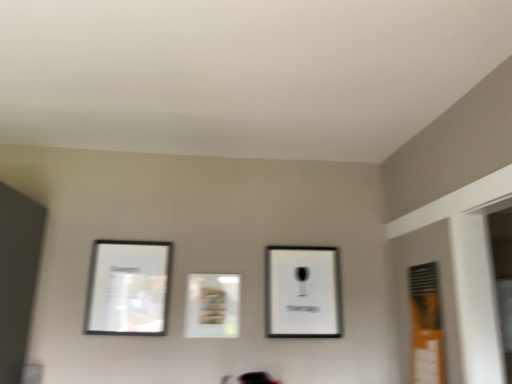
The image size is (512, 384). Describe the element at coordinates (303, 292) in the screenshot. I see `black matte picture frame at upper center, positioned as the first picture frame in right-to-left order` at that location.

The width and height of the screenshot is (512, 384). Describe the element at coordinates (212, 306) in the screenshot. I see `matte white picture frame at center, which ranks as the second picture frame in right-to-left order` at that location.

What do you see at coordinates (128, 288) in the screenshot? This screenshot has height=384, width=512. I see `matte black picture frame at left, which is the third picture frame from right to left` at bounding box center [128, 288].

You are a GUI agent. You are given a task and a screenshot of the screen. Output one action in this format:
    pyautogui.click(x=<x>, y=<y>)
    Task: Click on the black matte picture frame at upper center, which is the third picture frame from left to right
    The height and width of the screenshot is (384, 512).
    Given the screenshot: What is the action you would take?
    pyautogui.click(x=303, y=292)

Is orange matte window at right not close to matte white picture frame at center, which ranks as the second picture frame in right-to-left order?

orange matte window at right is near matte white picture frame at center, which ranks as the second picture frame in right-to-left order, not far away.

The image size is (512, 384). I want to click on window in front of the matte white picture frame at center, which ranks as the second picture frame in right-to-left order, so click(x=426, y=326).

Is orange matte window at right oriented away from matte white picture frame at center, which is counted as the 2th picture frame, starting from the left?

orange matte window at right does not have its back to matte white picture frame at center, which is counted as the 2th picture frame, starting from the left.

Which object is closer to the camera, orange matte window at right or matte white picture frame at center, which ranks as the second picture frame in right-to-left order?

orange matte window at right is more forward.

How different are the orientations of matte white picture frame at center, which ranks as the second picture frame in right-to-left order, and matte black picture frame at left, which is the third picture frame from right to left, in degrees?

The angular difference between matte white picture frame at center, which ranks as the second picture frame in right-to-left order, and matte black picture frame at left, which is the third picture frame from right to left, is 0.00815 degrees.

Where is `picture frame in front of the matte white picture frame at center, which ranks as the second picture frame in right-to-left order`? picture frame in front of the matte white picture frame at center, which ranks as the second picture frame in right-to-left order is located at coordinates pos(128,288).

In the image, is matte white picture frame at center, which ranks as the second picture frame in right-to-left order, positioned in front of or behind matte black picture frame at left, marked as the 1th picture frame in a left-to-right arrangement?

Visually, matte white picture frame at center, which ranks as the second picture frame in right-to-left order, is located behind matte black picture frame at left, marked as the 1th picture frame in a left-to-right arrangement.

Can you confirm if matte white picture frame at center, which ranks as the second picture frame in right-to-left order, is taller than matte black picture frame at left, marked as the 1th picture frame in a left-to-right arrangement?

No.

Does orange matte window at right appear on the left side of matte black picture frame at left, which is the third picture frame from right to left?

Incorrect, orange matte window at right is not on the left side of matte black picture frame at left, which is the third picture frame from right to left.

Looking at this image, is orange matte window at right outside of matte black picture frame at left, which is the third picture frame from right to left?

orange matte window at right lies outside matte black picture frame at left, which is the third picture frame from right to left,'s area.

Is the depth of orange matte window at right greater than that of matte black picture frame at left, which is the third picture frame from right to left?

No.

Is the surface of orange matte window at right in direct contact with matte black picture frame at left, marked as the 1th picture frame in a left-to-right arrangement?

orange matte window at right is not next to matte black picture frame at left, marked as the 1th picture frame in a left-to-right arrangement, and they're not touching.

Can you tell me how much matte white picture frame at center, which ranks as the second picture frame in right-to-left order, and orange matte window at right differ in facing direction?

The angle between the facing direction of matte white picture frame at center, which ranks as the second picture frame in right-to-left order, and the facing direction of orange matte window at right is 89.5 degrees.

Is matte white picture frame at center, which is counted as the 2th picture frame, starting from the left, to the right of orange matte window at right from the viewer's perspective?

Incorrect, matte white picture frame at center, which is counted as the 2th picture frame, starting from the left, is not on the right side of orange matte window at right.

Are matte white picture frame at center, which ranks as the second picture frame in right-to-left order, and orange matte window at right making contact?

matte white picture frame at center, which ranks as the second picture frame in right-to-left order, and orange matte window at right are not in contact.

Considering the sizes of objects matte white picture frame at center, which is counted as the 2th picture frame, starting from the left, and orange matte window at right in the image provided, who is thinner, matte white picture frame at center, which is counted as the 2th picture frame, starting from the left, or orange matte window at right?

matte white picture frame at center, which is counted as the 2th picture frame, starting from the left.

Who is bigger, matte black picture frame at left, marked as the 1th picture frame in a left-to-right arrangement, or black matte picture frame at upper center, which is the third picture frame from left to right?

With larger size is black matte picture frame at upper center, which is the third picture frame from left to right.

Is point (103, 250) positioned before point (300, 278)?

Yes, point (103, 250) is in front of point (300, 278).

Based on the photo, is matte black picture frame at left, which is the third picture frame from right to left, turned away from black matte picture frame at upper center, positioned as the first picture frame in right-to-left order?

No, matte black picture frame at left, which is the third picture frame from right to left, is not facing away from black matte picture frame at upper center, positioned as the first picture frame in right-to-left order.

Considering the sizes of objects matte black picture frame at left, marked as the 1th picture frame in a left-to-right arrangement, and black matte picture frame at upper center, positioned as the first picture frame in right-to-left order, in the image provided, who is shorter, matte black picture frame at left, marked as the 1th picture frame in a left-to-right arrangement, or black matte picture frame at upper center, positioned as the first picture frame in right-to-left order,?

matte black picture frame at left, marked as the 1th picture frame in a left-to-right arrangement, is shorter.

You are a GUI agent. You are given a task and a screenshot of the screen. Output one action in this format:
    pyautogui.click(x=<x>, y=<y>)
    Task: Click on the picture frame that is the 3rd object located above the orange matte window at right (from the image's perspective)
    The height and width of the screenshot is (384, 512).
    Given the screenshot: What is the action you would take?
    pyautogui.click(x=128, y=288)

In the image, is matte black picture frame at left, which is the third picture frame from right to left, on the left side or the right side of orange matte window at right?

Based on their positions, matte black picture frame at left, which is the third picture frame from right to left, is located to the left of orange matte window at right.

From a real-world perspective, is matte black picture frame at left, marked as the 1th picture frame in a left-to-right arrangement, on top of orange matte window at right?

Yes, from a real-world perspective, matte black picture frame at left, marked as the 1th picture frame in a left-to-right arrangement, is above orange matte window at right.

Is the position of matte black picture frame at left, marked as the 1th picture frame in a left-to-right arrangement, more distant than that of orange matte window at right?

Yes, it is.

From a real-world perspective, is orange matte window at right on black matte picture frame at upper center, which is the third picture frame from left to right?

Actually, orange matte window at right is physically below black matte picture frame at upper center, which is the third picture frame from left to right, in the real world.

Considering the points (426, 341) and (336, 271), which point is behind, point (426, 341) or point (336, 271)?

The point (336, 271) is farther from the camera.

Considering the relative positions of orange matte window at right and black matte picture frame at upper center, positioned as the first picture frame in right-to-left order, in the image provided, is orange matte window at right to the left of black matte picture frame at upper center, positioned as the first picture frame in right-to-left order, from the viewer's perspective?

Incorrect, orange matte window at right is not on the left side of black matte picture frame at upper center, positioned as the first picture frame in right-to-left order.

Measure the distance between orange matte window at right and black matte picture frame at upper center, positioned as the first picture frame in right-to-left order.

They are 21.74 inches apart.

This screenshot has height=384, width=512. What are the coordinates of `window below the matte white picture frame at center, which ranks as the second picture frame in right-to-left order (from the image's perspective)` in the screenshot? It's located at (426, 326).

I want to click on picture frame in front of the matte white picture frame at center, which is counted as the 2th picture frame, starting from the left, so (128, 288).

When comparing their distances from matte white picture frame at center, which is counted as the 2th picture frame, starting from the left, does matte black picture frame at left, which is the third picture frame from right to left, or black matte picture frame at upper center, which is the third picture frame from left to right, seem further?

black matte picture frame at upper center, which is the third picture frame from left to right, is further to matte white picture frame at center, which is counted as the 2th picture frame, starting from the left.

Estimate the real-world distances between objects in this image. Which object is further from matte white picture frame at center, which ranks as the second picture frame in right-to-left order, orange matte window at right or black matte picture frame at upper center, which is the third picture frame from left to right?

orange matte window at right is positioned further to the anchor matte white picture frame at center, which ranks as the second picture frame in right-to-left order.

Based on their spatial positions, is matte white picture frame at center, which is counted as the 2th picture frame, starting from the left, or orange matte window at right closer to matte black picture frame at left, which is the third picture frame from right to left?

Based on the image, matte white picture frame at center, which is counted as the 2th picture frame, starting from the left, appears to be nearer to matte black picture frame at left, which is the third picture frame from right to left.

Based on their spatial positions, is matte white picture frame at center, which is counted as the 2th picture frame, starting from the left, or black matte picture frame at upper center, positioned as the first picture frame in right-to-left order, closer to orange matte window at right?

The object closer to orange matte window at right is black matte picture frame at upper center, positioned as the first picture frame in right-to-left order.

Looking at the image, which one is located further to orange matte window at right, matte black picture frame at left, marked as the 1th picture frame in a left-to-right arrangement, or matte white picture frame at center, which is counted as the 2th picture frame, starting from the left?

matte black picture frame at left, marked as the 1th picture frame in a left-to-right arrangement.

Based on their spatial positions, is orange matte window at right or matte black picture frame at left, which is the third picture frame from right to left, further from black matte picture frame at upper center, which is the third picture frame from left to right?

Based on the image, matte black picture frame at left, which is the third picture frame from right to left, appears to be further to black matte picture frame at upper center, which is the third picture frame from left to right.

Which object lies nearer to the anchor point matte white picture frame at center, which ranks as the second picture frame in right-to-left order, matte black picture frame at left, marked as the 1th picture frame in a left-to-right arrangement, or orange matte window at right?

Based on the image, matte black picture frame at left, marked as the 1th picture frame in a left-to-right arrangement, appears to be nearer to matte white picture frame at center, which ranks as the second picture frame in right-to-left order.

Looking at the image, which one is located further to matte white picture frame at center, which ranks as the second picture frame in right-to-left order, black matte picture frame at upper center, which is the third picture frame from left to right, or orange matte window at right?

The object further to matte white picture frame at center, which ranks as the second picture frame in right-to-left order, is orange matte window at right.

Identify the location of picture frame between matte black picture frame at left, marked as the 1th picture frame in a left-to-right arrangement, and black matte picture frame at upper center, which is the third picture frame from left to right, from left to right. The width and height of the screenshot is (512, 384). (212, 306).

I want to click on picture frame between matte white picture frame at center, which ranks as the second picture frame in right-to-left order, and orange matte window at right, so click(x=303, y=292).